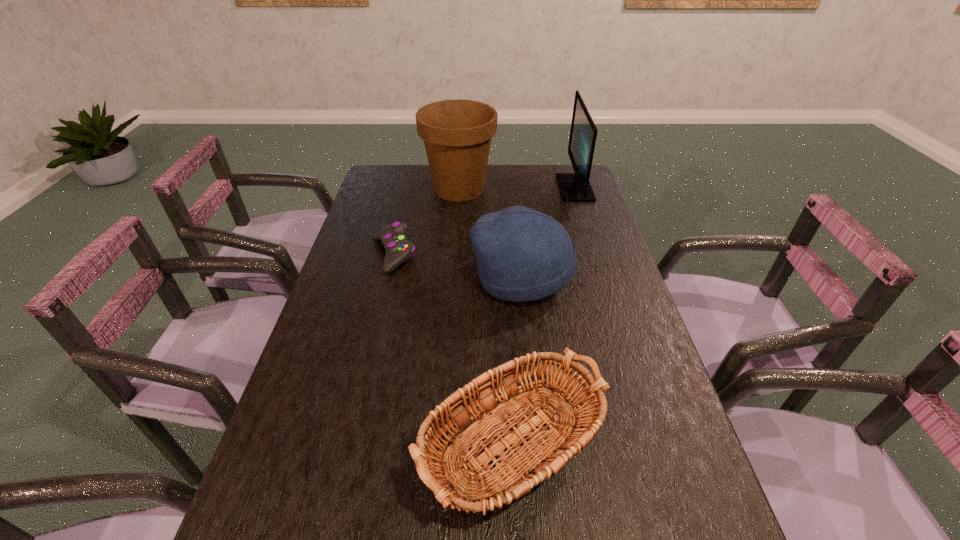
At what (x,y) coordinates should I click in order to perform the action: click on monitor. Please return your answer as a coordinate pair (x, y). Looking at the image, I should click on (574, 187).

This screenshot has width=960, height=540. Identify the location of flowerpot. (457, 134).

Identify the location of the third shortest object. Image resolution: width=960 pixels, height=540 pixels. (523, 255).

I want to click on the shortest object, so click(x=398, y=249).

This screenshot has width=960, height=540. What are the coordinates of `free spot located on the screen side of the monitor` in the screenshot? It's located at (530, 188).

At what (x,y) coordinates should I click in order to perform the action: click on blank area located on the screen side of the monitor. Please return your answer as a coordinate pair (x, y). Looking at the image, I should click on (540, 188).

Find the location of a particular element. vacant region located 0.060m on the screen side of the monitor is located at coordinates (543, 188).

Image resolution: width=960 pixels, height=540 pixels. In order to click on vacant space located on the right of the flowerpot in this screenshot , I will do `click(560, 189)`.

Locate an element on the screen. vacant area located 0.080m on the back of the skullcap is located at coordinates (516, 233).

In order to click on vacant space situated on the right of the control in this screenshot , I will do `click(450, 254)`.